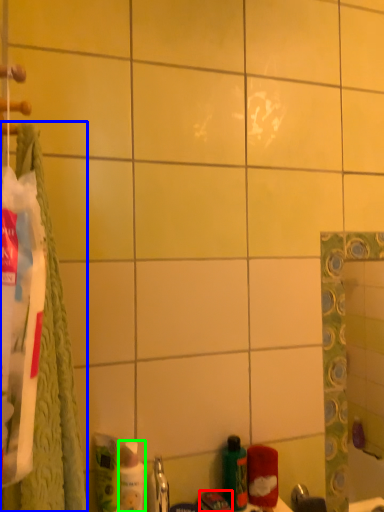
Question: Which is nearer to the toothpaste (highlighted by a red box)? bath towel (highlighted by a blue box) or mouthwash (highlighted by a green box).

Choices:
 (A) bath towel
 (B) mouthwash

Answer: (B)